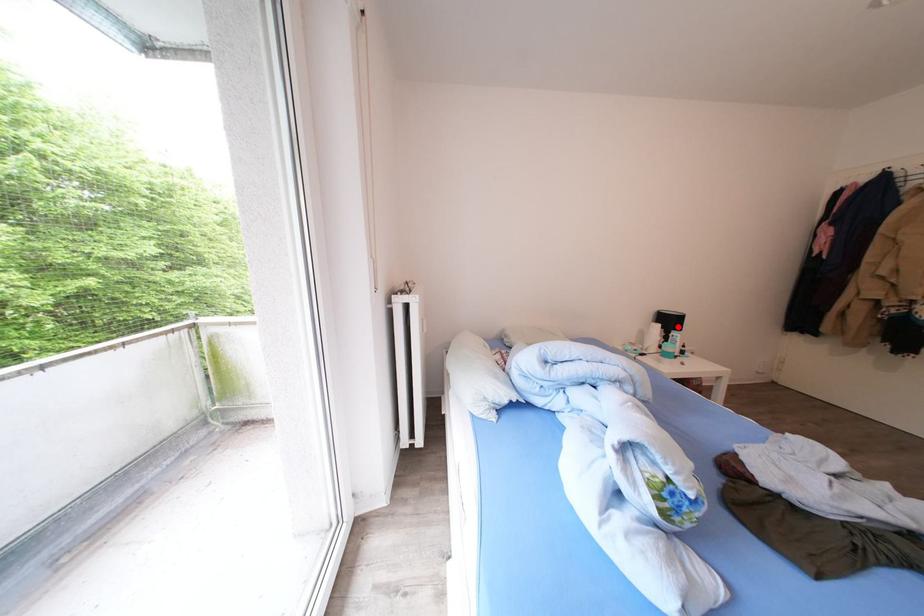
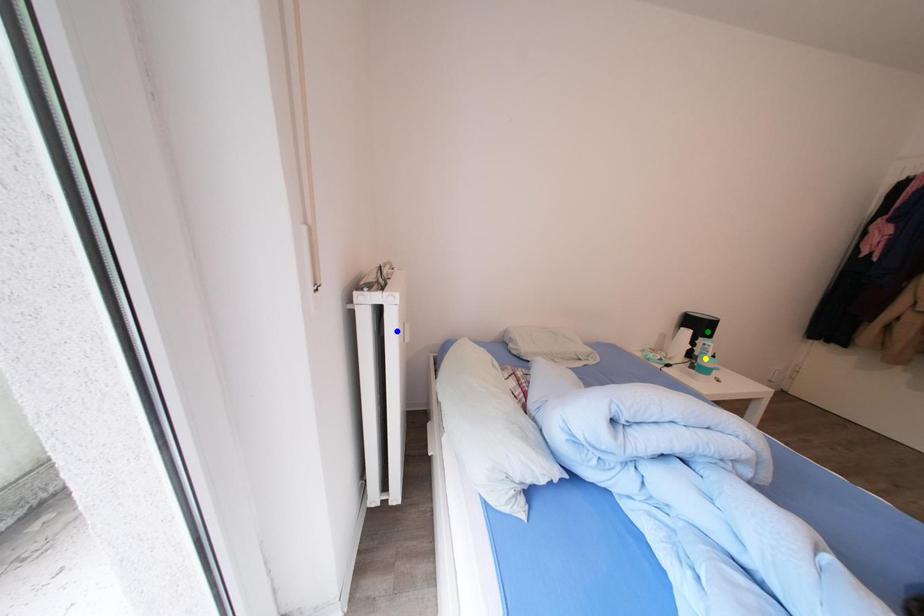
Question: I am providing you with two images of the same scene from different viewpoints. A red point is marked on the first image. You are given multiple points on the second image. Which spot in image 2 lines up with the point in image 1?

Choices:
 (A) green point
 (B) blue point
 (C) yellow point

Answer: (A)